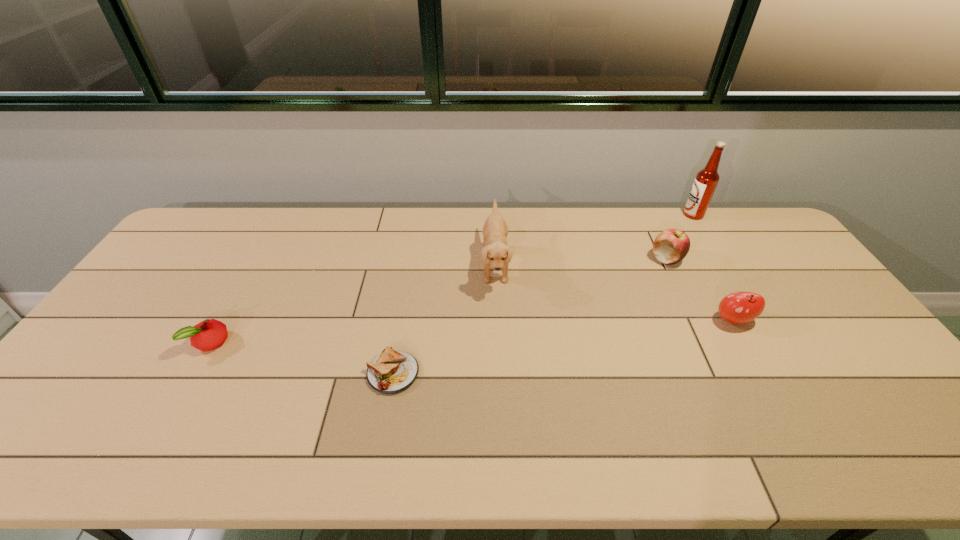
This screenshot has height=540, width=960. Identify the location of alcohol. (706, 180).

Identify the location of the tallest object. (706, 180).

Identify the location of the fifth shortest object. This screenshot has height=540, width=960. (495, 251).

Identify the location of the fourth object from right to left. (495, 251).

Identify the location of the farthest apple. (671, 246).

Identify the location of the second shortest object. Image resolution: width=960 pixels, height=540 pixels. (209, 334).

Image resolution: width=960 pixels, height=540 pixels. I want to click on the shortest apple, so click(209, 334).

The image size is (960, 540). What are the coordinates of `the shortest object` in the screenshot? It's located at (393, 371).

Where is `the fifth object from right to left`? This screenshot has height=540, width=960. the fifth object from right to left is located at coordinates (393, 371).

The image size is (960, 540). I want to click on vacant space located on the label side of the tallest object, so click(611, 214).